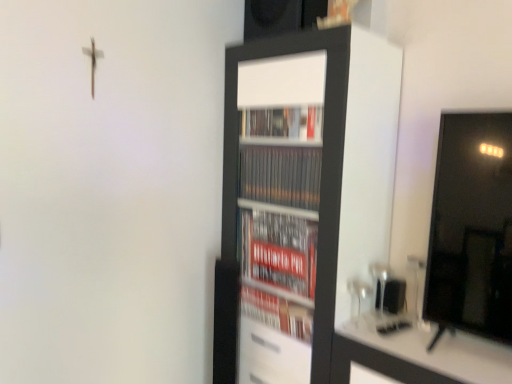
Describe the element at coordinates (302, 198) in the screenshot. I see `black matte bookcase at center` at that location.

I want to click on black matte bookcase at center, so [x=302, y=198].

Locate an element on the screen. Image resolution: width=512 pixels, height=384 pixels. black matte bookcase at center is located at coordinates (302, 198).